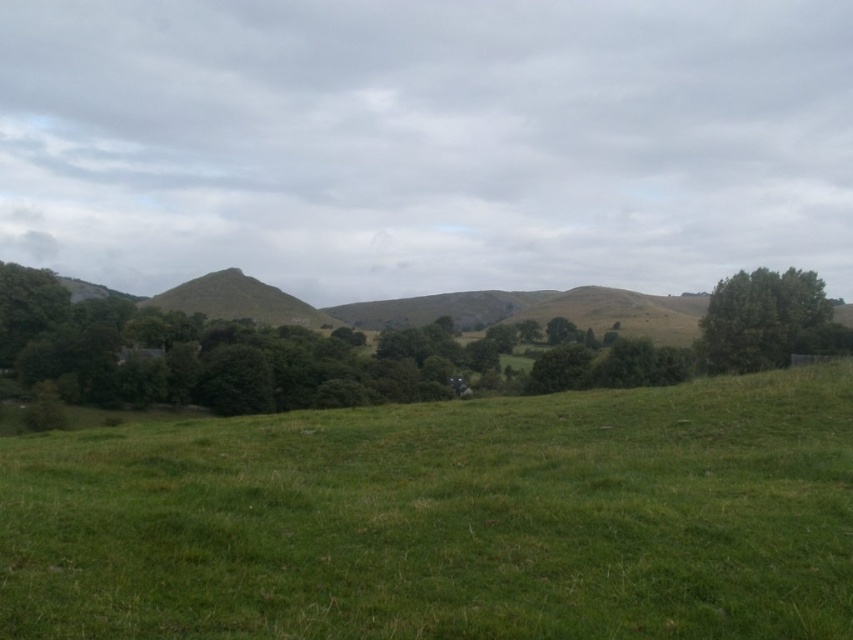
Does green grassy field at center have a smaller size compared to green leafy tree at right?

Indeed, green grassy field at center has a smaller size compared to green leafy tree at right.

Can you confirm if green grassy field at center is bigger than green leafy tree at right?

No.

Identify the location of green grassy field at center. The height and width of the screenshot is (640, 853). (445, 518).